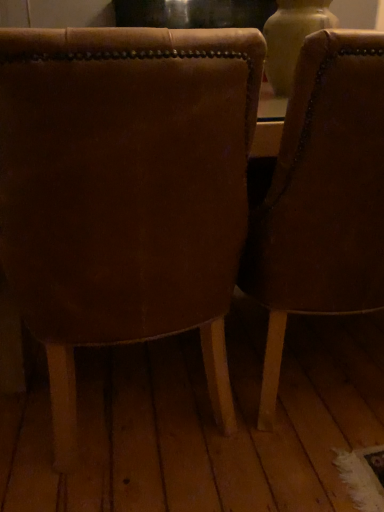
Find the location of a particular element. leather chair at center, the first chair positioned from the left is located at coordinates (125, 191).

Measure the distance between leather chair at center, the first chair positioned from the left, and camera.

The depth of leather chair at center, the first chair positioned from the left, is 20.77 inches.

What do you see at coordinates (125, 191) in the screenshot? I see `leather chair at center, the first chair positioned from the left` at bounding box center [125, 191].

Measure the distance between leather chair at center, placed as the second chair when sorted from left to right, and camera.

A distance of 25.69 inches exists between leather chair at center, placed as the second chair when sorted from left to right, and camera.

Describe the element at coordinates (322, 196) in the screenshot. Image resolution: width=384 pixels, height=512 pixels. I see `leather chair at center, placed as the second chair when sorted from left to right` at that location.

How much space does leather chair at center, which ranks as the first chair in right-to-left order, occupy horizontally?

leather chair at center, which ranks as the first chair in right-to-left order, is 26.25 inches wide.

Locate an element on the screen. The image size is (384, 512). leather chair at center, placed as the second chair when sorted from left to right is located at coordinates (322, 196).

Identify the location of leather chair at center, which appears as the second chair when viewed from the right. The width and height of the screenshot is (384, 512). (125, 191).

Between leather chair at center, placed as the second chair when sorted from left to right, and leather chair at center, the first chair positioned from the left, which one appears on the right side from the viewer's perspective?

Positioned to the right is leather chair at center, placed as the second chair when sorted from left to right.

Considering the relative positions of leather chair at center, which ranks as the first chair in right-to-left order, and leather chair at center, the first chair positioned from the left, in the image provided, is leather chair at center, which ranks as the first chair in right-to-left order, in front of leather chair at center, the first chair positioned from the left,?

No, it is not.

Is point (301, 310) less distant than point (41, 36)?

No, it is not.

From the image's perspective, does leather chair at center, placed as the second chair when sorted from left to right, appear higher than leather chair at center, the first chair positioned from the left?

Indeed, from the image's perspective, leather chair at center, placed as the second chair when sorted from left to right, is shown above leather chair at center, the first chair positioned from the left.

From a real-world perspective, is leather chair at center, which ranks as the first chair in right-to-left order, over leather chair at center, which appears as the second chair when viewed from the right?

No, from a real-world perspective, leather chair at center, which ranks as the first chair in right-to-left order, is not over leather chair at center, which appears as the second chair when viewed from the right

Which of these two, leather chair at center, which ranks as the first chair in right-to-left order, or leather chair at center, which appears as the second chair when viewed from the right, is thinner?

leather chair at center, which ranks as the first chair in right-to-left order.

Is leather chair at center, which ranks as the first chair in right-to-left order, taller or shorter than leather chair at center, the first chair positioned from the left?

Considering their sizes, leather chair at center, which ranks as the first chair in right-to-left order, has more height than leather chair at center, the first chair positioned from the left.

Is leather chair at center, placed as the second chair when sorted from left to right, smaller than leather chair at center, the first chair positioned from the left?

Yes.

Is leather chair at center, which ranks as the first chair in right-to-left order, surrounding leather chair at center, which appears as the second chair when viewed from the right?

Definitely not — leather chair at center, which appears as the second chair when viewed from the right, is not inside leather chair at center, which ranks as the first chair in right-to-left order.

Is leather chair at center, which ranks as the first chair in right-to-left order, next to leather chair at center, the first chair positioned from the left, and touching it?

No.

Could you tell me if leather chair at center, placed as the second chair when sorted from left to right, is facing leather chair at center, the first chair positioned from the left?

No, leather chair at center, placed as the second chair when sorted from left to right, is not turned towards leather chair at center, the first chair positioned from the left.

Measure the distance between leather chair at center, which ranks as the first chair in right-to-left order, and leather chair at center, the first chair positioned from the left.

leather chair at center, which ranks as the first chair in right-to-left order, and leather chair at center, the first chair positioned from the left, are 9.30 inches apart.

Identify the location of chair below the leather chair at center, which appears as the second chair when viewed from the right (from a real-world perspective). Image resolution: width=384 pixels, height=512 pixels. (322, 196).

Is leather chair at center, the first chair positioned from the left, to the left of leather chair at center, placed as the second chair when sorted from left to right, from the viewer's perspective?

Yes, leather chair at center, the first chair positioned from the left, is to the left of leather chair at center, placed as the second chair when sorted from left to right.

Is the depth of leather chair at center, the first chair positioned from the left, less than that of leather chair at center, placed as the second chair when sorted from left to right?

Yes, leather chair at center, the first chair positioned from the left, is in front of leather chair at center, placed as the second chair when sorted from left to right.

Considering the points (259, 69) and (366, 89), which point is behind, point (259, 69) or point (366, 89)?

Point (366, 89)

From the image's perspective, relative to leather chair at center, placed as the second chair when sorted from left to right, is leather chair at center, which appears as the second chair when viewed from the right, above or below?

Based on their image positions, leather chair at center, which appears as the second chair when viewed from the right, is located beneath leather chair at center, placed as the second chair when sorted from left to right.

From a real-world perspective, is leather chair at center, which appears as the second chair when viewed from the right, located higher than leather chair at center, placed as the second chair when sorted from left to right?

Yes, from a real-world perspective, leather chair at center, which appears as the second chair when viewed from the right, is on top of leather chair at center, placed as the second chair when sorted from left to right.

Looking at this image, which of these two, leather chair at center, the first chair positioned from the left, or leather chair at center, which ranks as the first chair in right-to-left order, is wider?

leather chair at center, the first chair positioned from the left, is wider.

Between leather chair at center, which appears as the second chair when viewed from the right, and leather chair at center, placed as the second chair when sorted from left to right, which one has more height?

leather chair at center, placed as the second chair when sorted from left to right.

Is leather chair at center, the first chair positioned from the left, smaller than leather chair at center, placed as the second chair when sorted from left to right?

No, leather chair at center, the first chair positioned from the left, is not smaller than leather chair at center, placed as the second chair when sorted from left to right.

Which is correct: leather chair at center, which appears as the second chair when viewed from the right, is inside leather chair at center, which ranks as the first chair in right-to-left order, or outside of it?

leather chair at center, which appears as the second chair when viewed from the right, lies outside leather chair at center, which ranks as the first chair in right-to-left order.

Consider the image. Are leather chair at center, the first chair positioned from the left, and leather chair at center, which ranks as the first chair in right-to-left order, located far from each other?

They are positioned close to each other.

Is leather chair at center, which appears as the second chair when viewed from the right, aimed at leather chair at center, placed as the second chair when sorted from left to right?

No, leather chair at center, which appears as the second chair when viewed from the right, does not turn towards leather chair at center, placed as the second chair when sorted from left to right.

What's the angular difference between leather chair at center, the first chair positioned from the left, and leather chair at center, placed as the second chair when sorted from left to right,'s facing directions?

The facing directions of leather chair at center, the first chair positioned from the left, and leather chair at center, placed as the second chair when sorted from left to right, are 0.000405 degrees apart.

Could you measure the distance between leather chair at center, which appears as the second chair when viewed from the right, and leather chair at center, placed as the second chair when sorted from left to right?

They are 9.30 inches apart.

Find the location of a particular element. chair behind the leather chair at center, which appears as the second chair when viewed from the right is located at coordinates (322, 196).

Image resolution: width=384 pixels, height=512 pixels. What are the coordinates of `chair on the right side of leather chair at center, the first chair positioned from the left` in the screenshot? It's located at (x=322, y=196).

Image resolution: width=384 pixels, height=512 pixels. I want to click on chair that appears behind the leather chair at center, the first chair positioned from the left, so click(x=322, y=196).